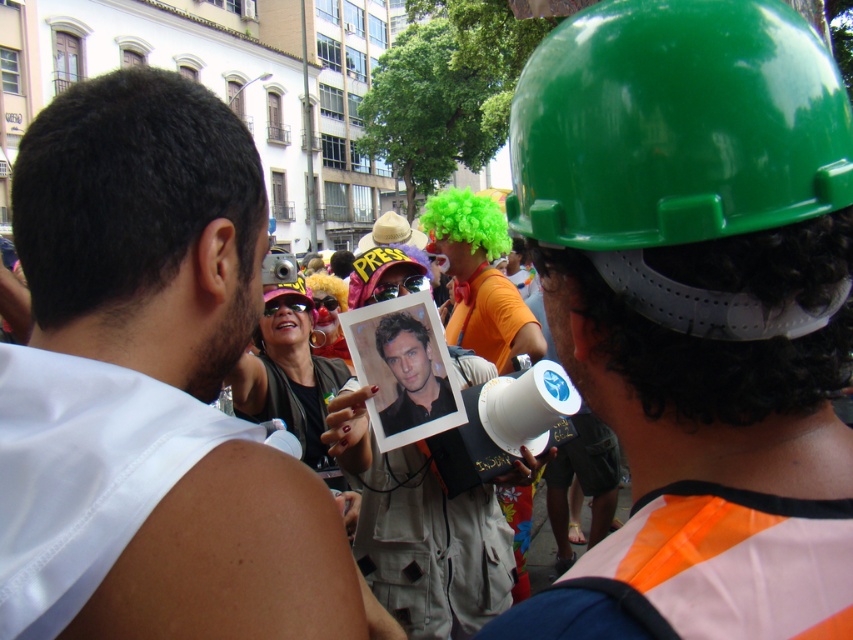
From the picture: Who is lower down, green glossy helmet at upper right or smooth black shirt at center?

smooth black shirt at center is below.

Consider the image. Does green glossy helmet at upper right appear on the left side of smooth black shirt at center?

In fact, green glossy helmet at upper right is to the right of smooth black shirt at center.

Between point (514, 156) and point (409, 346), which one is positioned in front?

Positioned in front is point (514, 156).

You are a GUI agent. You are given a task and a screenshot of the screen. Output one action in this format:
    pyautogui.click(x=<x>, y=<y>)
    Task: Click on the green glossy helmet at upper right
    
    Given the screenshot: What is the action you would take?
    pyautogui.click(x=680, y=147)

Is green glossy helmet at upper right bigger than matte black photo at center?

No, green glossy helmet at upper right is not bigger than matte black photo at center.

Who is positioned more to the left, green glossy helmet at upper right or matte black photo at center?

From the viewer's perspective, matte black photo at center appears more on the left side.

At what (x,y) coordinates should I click in order to perform the action: click on green glossy helmet at upper right. Please return your answer as a coordinate pair (x, y). Image resolution: width=853 pixels, height=640 pixels. Looking at the image, I should click on (680, 147).

Find the location of a particular element. This screenshot has width=853, height=640. green glossy helmet at upper right is located at coordinates (680, 147).

Who is more distant from viewer, (415,328) or (366,268)?

The point (366,268) is behind.

Is smooth black shirt at center below green hard hat at center?

Yes.

Is point (439, 413) closer to camera compared to point (378, 253)?

Yes.

This screenshot has height=640, width=853. I want to click on smooth black shirt at center, so click(410, 372).